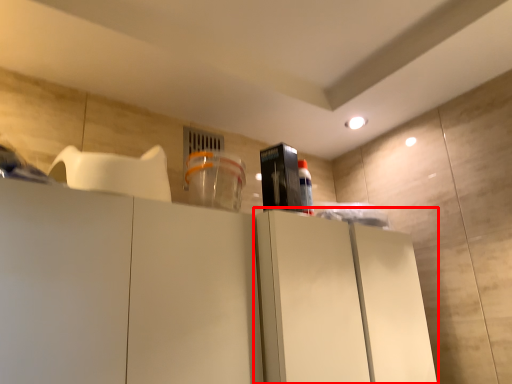
Question: From the image's perspective, where is cabinetry (annotated by the red box) located in relation to appliance in the image?

Choices:
 (A) below
 (B) above

Answer: (A)